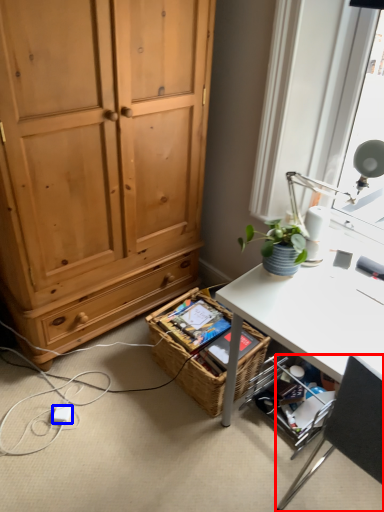
Question: Which object appears closest to the camera in this image, chair (highlighted by a red box) or power outlet (highlighted by a blue box)?

Choices:
 (A) chair
 (B) power outlet

Answer: (A)